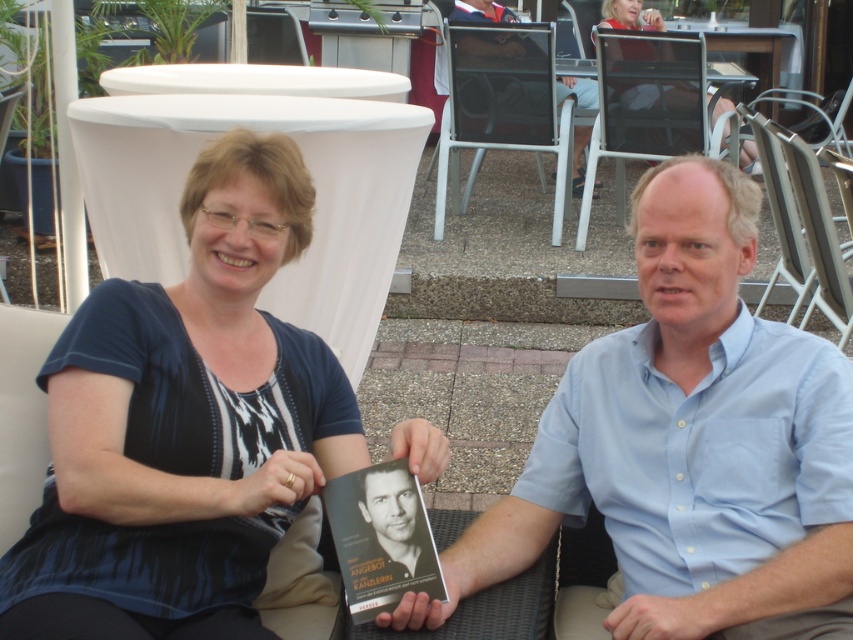
You are a photographer adjusting your camera to focus on two points in the scene. The first point is at coordinates point (479, 20) and the second is at point (635, 22). Which point should you focus on first if you want to ensure both are in focus?

You should focus on point (479, 20) first because it is closer to the camera than point (635, 22). This ensures the closer point is in focus before adjusting for the farther one.

You are a photographer trying to capture a clear shot of the light blue shirt at center and the light blue shirt at upper right. Which one is closer to the camera?

The light blue shirt at center is closer to the camera because it is in front of the light blue shirt at upper right.

You are a photographer setting up for a group photo. You notice the light blue shirt at upper right and the matte black dress at upper center. Which clothing item appears narrower in the image?

→ The light blue shirt at upper right has a lesser width compared to the matte black dress at upper center, so it appears narrower.